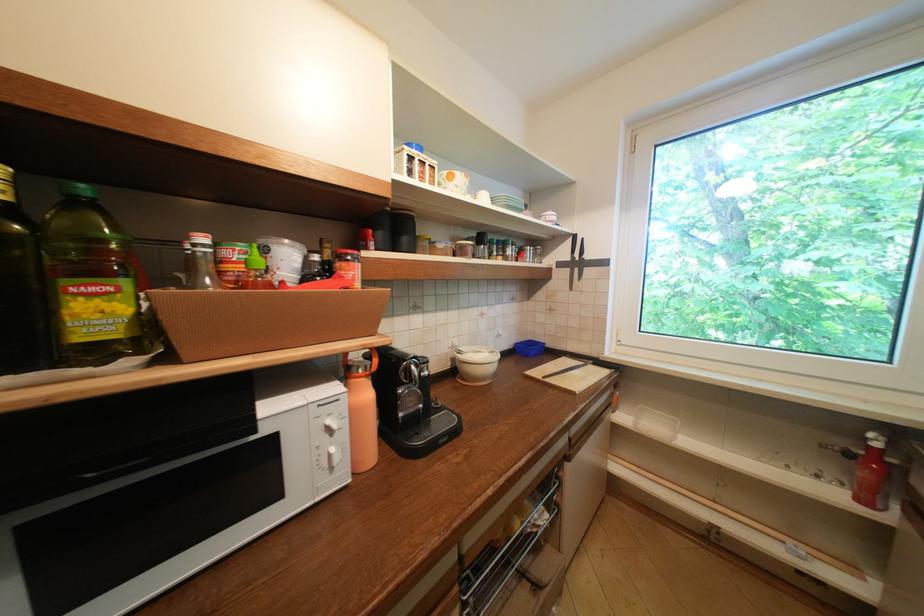
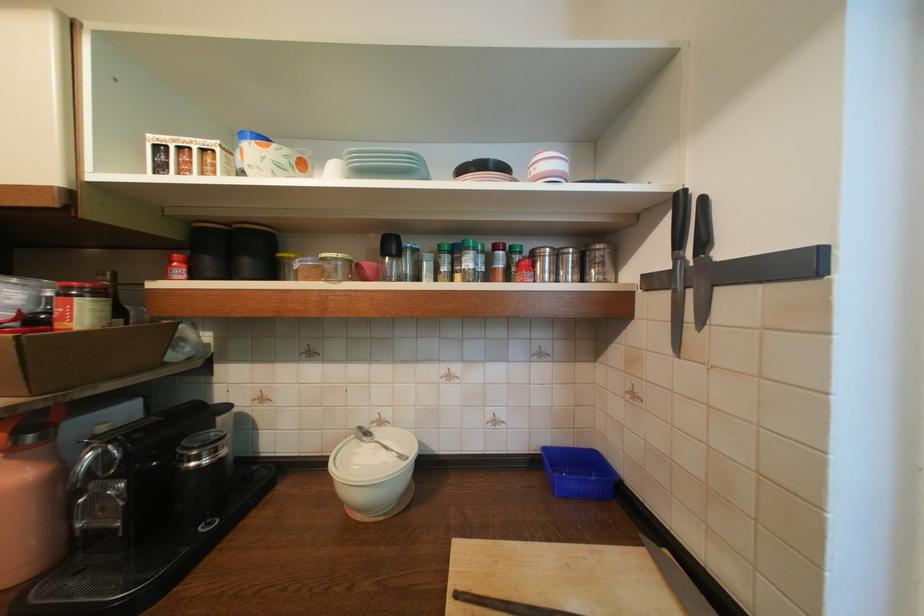
In the second image, find the point that corresponds to [497,261] in the first image.

(444, 282)